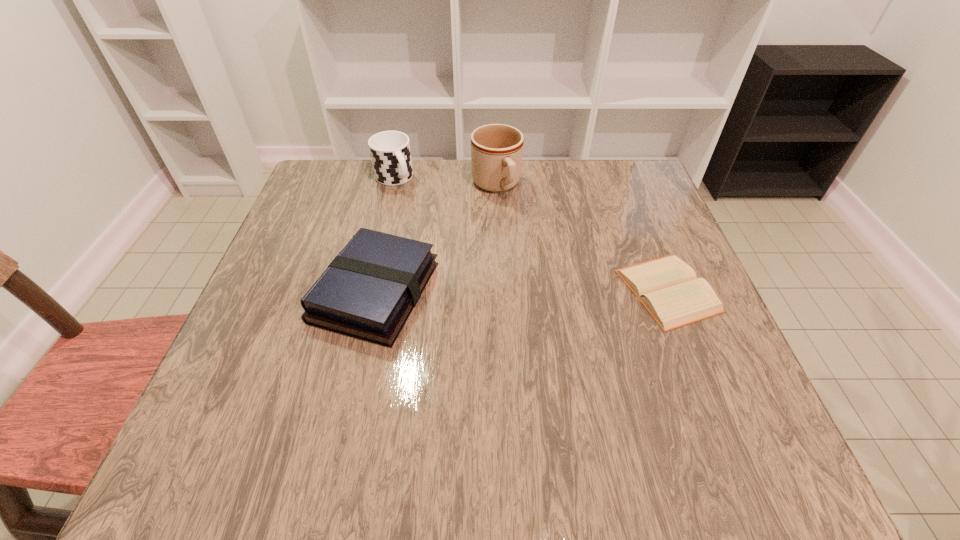
In order to click on free space on the desktop that is between the book and the shortest object and is positioned on the side of the mug with the handle in this screenshot , I will do `click(559, 291)`.

Locate an element on the screen. vacant space on the desktop that is between the book and the diary and is positioned on the side of the second tallest object with the handle is located at coordinates (487, 292).